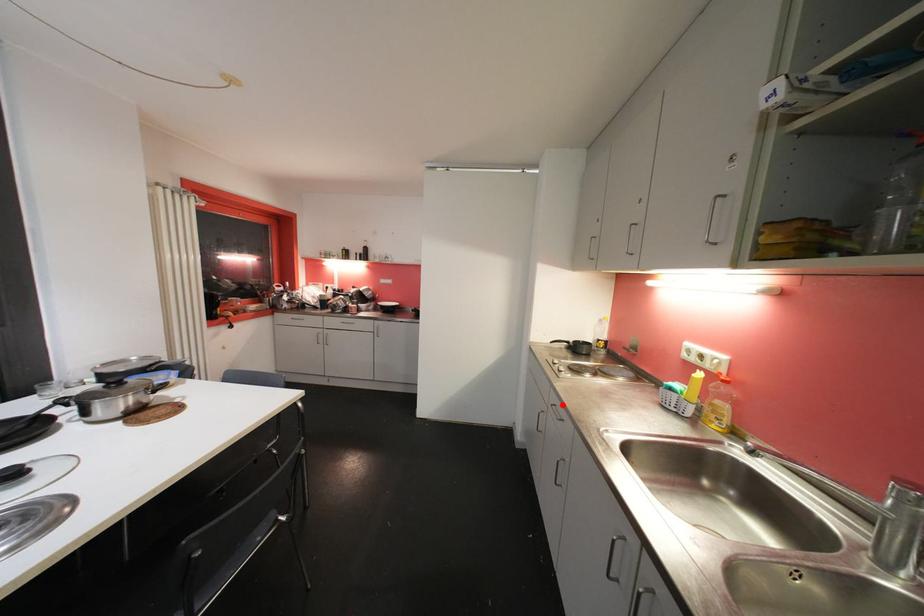
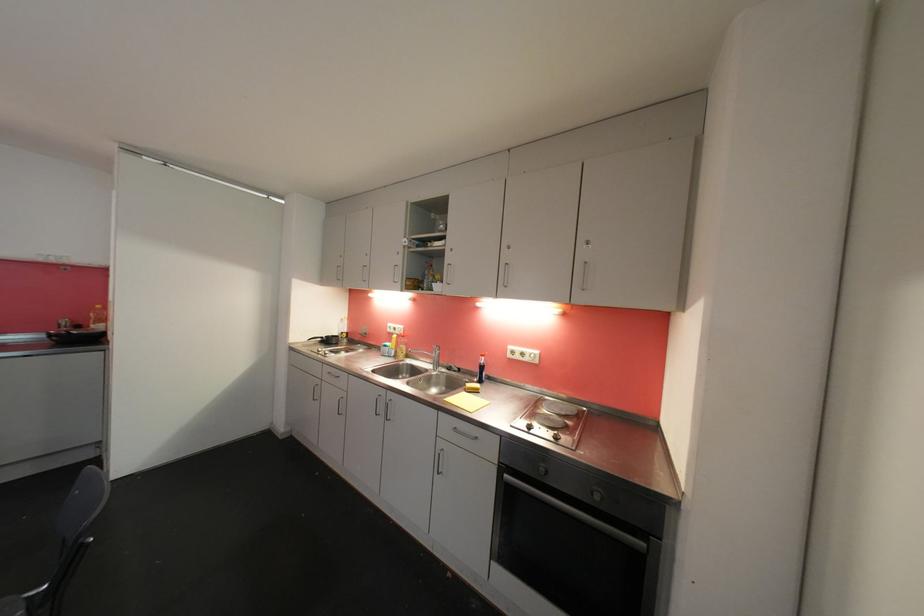
Where in the second image is the point corresponding to the highlighted location from the first image?

(336, 371)